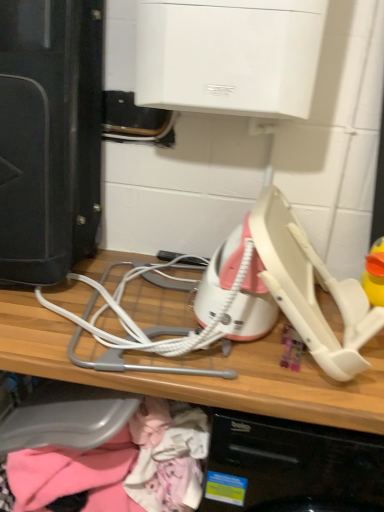
Question: Could black plastic speaker at left be considered to be inside pink fabric at lower left?

Choices:
 (A) no
 (B) yes

Answer: (A)

Question: Is pink fabric at lower left looking in the opposite direction of black plastic speaker at left?

Choices:
 (A) no
 (B) yes

Answer: (A)

Question: Is pink fabric at lower left thinner than black plastic speaker at left?

Choices:
 (A) no
 (B) yes

Answer: (B)

Question: From the image's perspective, is pink fabric at lower left located beneath black plastic speaker at left?

Choices:
 (A) yes
 (B) no

Answer: (A)

Question: Does pink fabric at lower left have a smaller size compared to black plastic speaker at left?

Choices:
 (A) no
 (B) yes

Answer: (A)

Question: Is pink fabric at lower left at the right side of black plastic speaker at left?

Choices:
 (A) yes
 (B) no

Answer: (A)

Question: Considering the relative positions of black plastic speaker at left and pink fabric at lower left in the image provided, is black plastic speaker at left to the left of pink fabric at lower left from the viewer's perspective?

Choices:
 (A) no
 (B) yes

Answer: (B)

Question: Is black plastic speaker at left not inside pink fabric at lower left?

Choices:
 (A) no
 (B) yes

Answer: (B)

Question: From the image's perspective, is black plastic speaker at left under pink fabric at lower left?

Choices:
 (A) no
 (B) yes

Answer: (A)

Question: Could you tell me if black plastic speaker at left is facing pink fabric at lower left?

Choices:
 (A) yes
 (B) no

Answer: (B)

Question: From the image's perspective, is black plastic speaker at left over pink fabric at lower left?

Choices:
 (A) no
 (B) yes

Answer: (B)

Question: Can you confirm if black plastic speaker at left is bigger than pink fabric at lower left?

Choices:
 (A) no
 (B) yes

Answer: (A)

Question: Does pink fabric at lower left have a smaller size compared to white plastic computer at center?

Choices:
 (A) yes
 (B) no

Answer: (A)